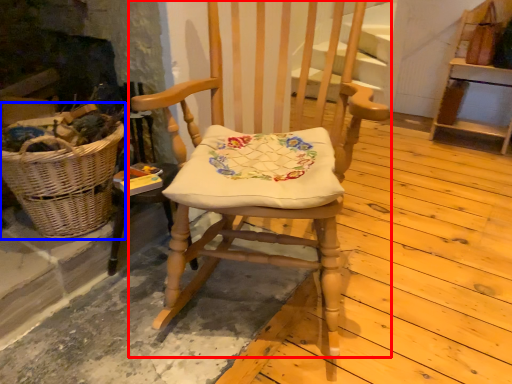
Question: Which point is further to the camera, chair (highlighted by a red box) or picnic basket (highlighted by a blue box)?

Choices:
 (A) chair
 (B) picnic basket

Answer: (B)